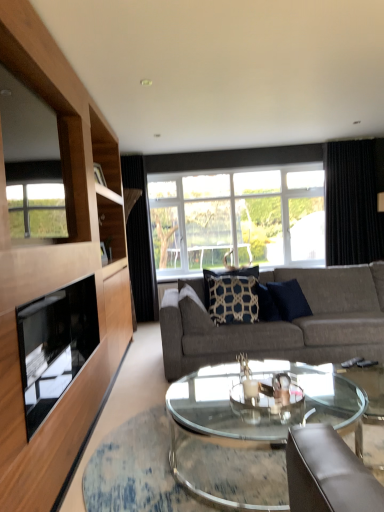
Question: Is the position of black textured curtain at center, which is the second curtain from right to left, more distant than that of transparent glass coffee table at center?

Choices:
 (A) no
 (B) yes

Answer: (B)

Question: Would you say black textured curtain at center, which is the second curtain from right to left, contains transparent glass coffee table at center?

Choices:
 (A) yes
 (B) no

Answer: (B)

Question: Is black textured curtain at center, which is the second curtain from right to left, located outside transparent glass coffee table at center?

Choices:
 (A) yes
 (B) no

Answer: (A)

Question: Is black textured curtain at center, which is the second curtain from right to left, touching transparent glass coffee table at center?

Choices:
 (A) yes
 (B) no

Answer: (B)

Question: Does black textured curtain at center, which is the second curtain from right to left, appear on the right side of transparent glass coffee table at center?

Choices:
 (A) yes
 (B) no

Answer: (B)

Question: Is black textured curtain at center, which is the second curtain from right to left, at the left side of transparent glass coffee table at center?

Choices:
 (A) yes
 (B) no

Answer: (A)

Question: Can you confirm if black textured curtain at center, placed as the first curtain when sorted from left to right, is positioned to the right of gray fabric couch at center?

Choices:
 (A) no
 (B) yes

Answer: (A)

Question: Is gray fabric couch at center surrounded by black textured curtain at center, which is the second curtain from right to left?

Choices:
 (A) yes
 (B) no

Answer: (B)

Question: From a real-world perspective, does black textured curtain at center, placed as the first curtain when sorted from left to right, sit lower than gray fabric couch at center?

Choices:
 (A) no
 (B) yes

Answer: (A)

Question: Can you confirm if black textured curtain at center, which is the second curtain from right to left, is positioned to the left of gray fabric couch at center?

Choices:
 (A) no
 (B) yes

Answer: (B)

Question: Can you see black textured curtain at center, which is the second curtain from right to left, touching gray fabric couch at center?

Choices:
 (A) yes
 (B) no

Answer: (B)

Question: Does black textured curtain at center, which is the second curtain from right to left, turn towards gray fabric couch at center?

Choices:
 (A) yes
 (B) no

Answer: (B)

Question: Can you confirm if black textured curtain at center, placed as the first curtain when sorted from left to right, is taller than navy blue textured pillow at center, the first pillow viewed from the left?

Choices:
 (A) yes
 (B) no

Answer: (A)